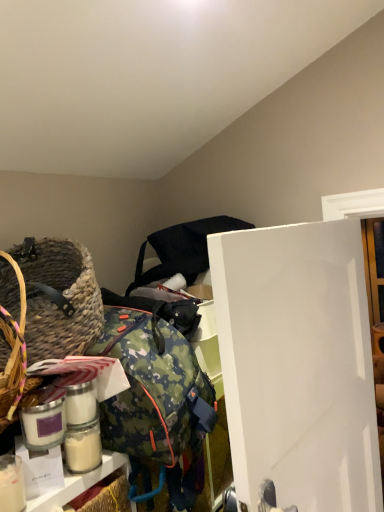
Question: Is black fabric bag at upper center positioned behind white matte glass jar at lower left?

Choices:
 (A) no
 (B) yes

Answer: (B)

Question: Is there a large distance between black fabric bag at upper center and white matte glass jar at lower left?

Choices:
 (A) yes
 (B) no

Answer: (B)

Question: Does black fabric bag at upper center have a larger size compared to white matte glass jar at lower left?

Choices:
 (A) yes
 (B) no

Answer: (A)

Question: Is black fabric bag at upper center positioned beyond the bounds of white matte glass jar at lower left?

Choices:
 (A) no
 (B) yes

Answer: (B)

Question: Considering the relative sizes of black fabric bag at upper center and white matte glass jar at lower left in the image provided, is black fabric bag at upper center thinner than white matte glass jar at lower left?

Choices:
 (A) yes
 (B) no

Answer: (B)

Question: Is white matte glass jar at lower left to the left or to the right of white glossy door at center right in the image?

Choices:
 (A) left
 (B) right

Answer: (A)

Question: Is white matte glass jar at lower left bigger or smaller than white glossy door at center right?

Choices:
 (A) big
 (B) small

Answer: (B)

Question: From a real-world perspective, is white matte glass jar at lower left positioned above or below white glossy door at center right?

Choices:
 (A) below
 (B) above

Answer: (B)

Question: Is white matte glass jar at lower left in front of or behind white glossy door at center right in the image?

Choices:
 (A) behind
 (B) front

Answer: (A)

Question: From the image's perspective, relative to white glossy door at center right, is black fabric bag at upper center above or below?

Choices:
 (A) below
 (B) above

Answer: (B)

Question: Considering the positions of black fabric bag at upper center and white glossy door at center right in the image, is black fabric bag at upper center bigger or smaller than white glossy door at center right?

Choices:
 (A) big
 (B) small

Answer: (B)

Question: Does point (201, 264) appear closer or farther from the camera than point (344, 483)?

Choices:
 (A) farther
 (B) closer

Answer: (A)

Question: Is black fabric bag at upper center taller or shorter than white glossy door at center right?

Choices:
 (A) short
 (B) tall

Answer: (A)

Question: From a real-world perspective, is black fabric bag at upper center physically located above or below white matte glass jar at lower left?

Choices:
 (A) below
 (B) above

Answer: (B)

Question: From the image's perspective, is black fabric bag at upper center located above or below white matte glass jar at lower left?

Choices:
 (A) above
 (B) below

Answer: (A)